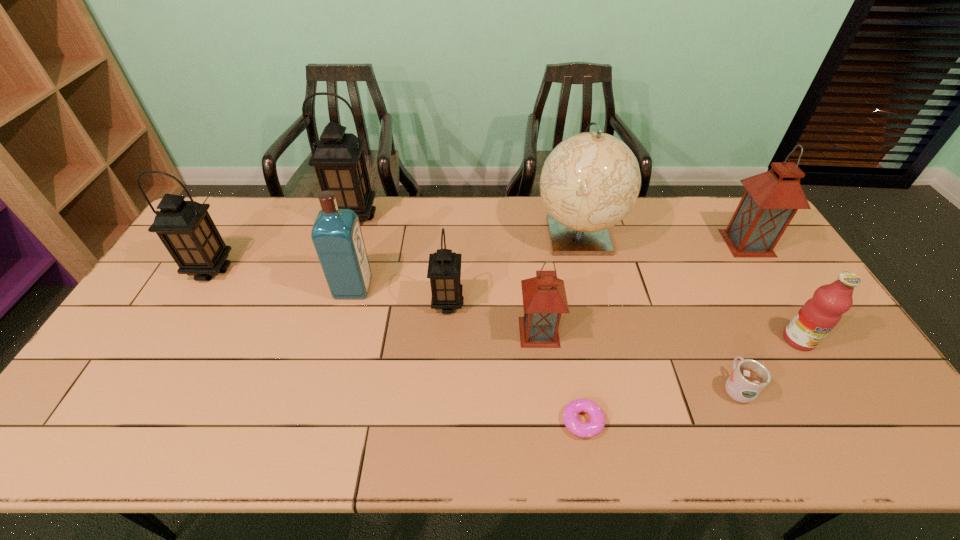
Where is `object at the near edge`? This screenshot has height=540, width=960. object at the near edge is located at coordinates (596, 424).

Where is `object situated at the left edge`? This screenshot has height=540, width=960. object situated at the left edge is located at coordinates (186, 229).

Image resolution: width=960 pixels, height=540 pixels. In order to click on lantern located at the right edge in this screenshot , I will do `click(772, 198)`.

What are the coordinates of `fruit juice that is at the right edge` in the screenshot? It's located at (820, 314).

This screenshot has width=960, height=540. Identify the location of object that is at the far right corner. (772, 198).

Identify the location of vacant space at the far edge. (411, 208).

At what (x,y) coordinates should I click in order to perform the action: click on free space at the near edge. Please return your answer as a coordinate pair (x, y). This screenshot has width=960, height=540. Looking at the image, I should click on (370, 434).

The width and height of the screenshot is (960, 540). In the image, there is a desktop. Identify the location of vacant space at the left edge. (141, 324).

In order to click on vacant area at the right edge in this screenshot , I will do `click(828, 390)`.

In order to click on free space between the doughnut and the cup in this screenshot , I will do `click(660, 405)`.